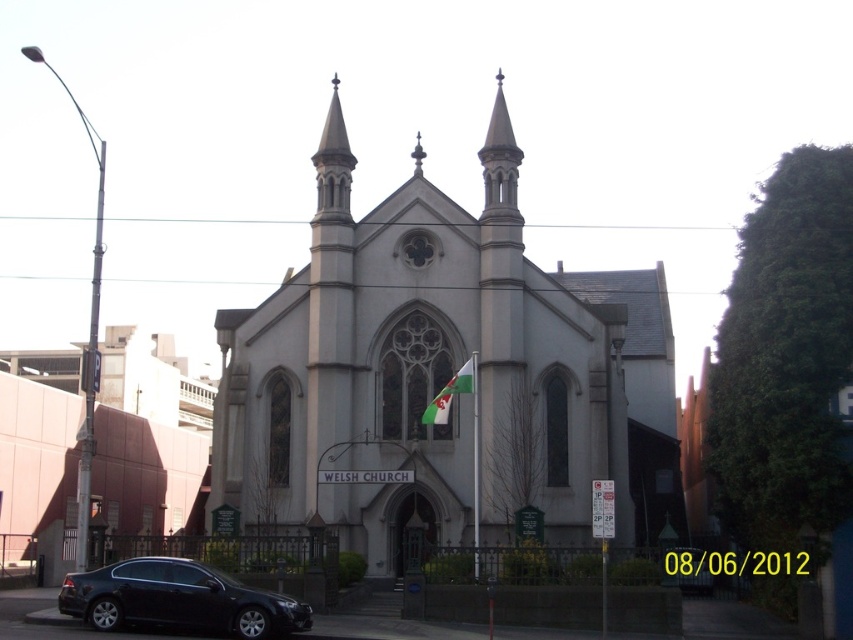
Is white stone church at center above white fabric flag at center?

Yes, white stone church at center is above white fabric flag at center.

Does white stone church at center have a smaller size compared to white fabric flag at center?

No, white stone church at center is not smaller than white fabric flag at center.

Between point (549, 275) and point (434, 413), which one is positioned behind?

Positioned behind is point (549, 275).

Find the location of `white stone church at center`. white stone church at center is located at coordinates (444, 385).

Can you confirm if white stone church at center is shorter than matte black sedan at lower left?

In fact, white stone church at center may be taller than matte black sedan at lower left.

Consider the image. Who is more forward, (567, 355) or (90, 579)?

Positioned in front is point (90, 579).

What do you see at coordinates (444, 385) in the screenshot? This screenshot has width=853, height=640. I see `white stone church at center` at bounding box center [444, 385].

Locate an element on the screen. white stone church at center is located at coordinates (444, 385).

Is point (491, 154) positioned after point (326, 156)?

No, (491, 154) is in front of (326, 156).

Between smooth gray spire at center and white stone spire at upper center, which one has less height?

With less height is smooth gray spire at center.

I want to click on smooth gray spire at center, so click(498, 163).